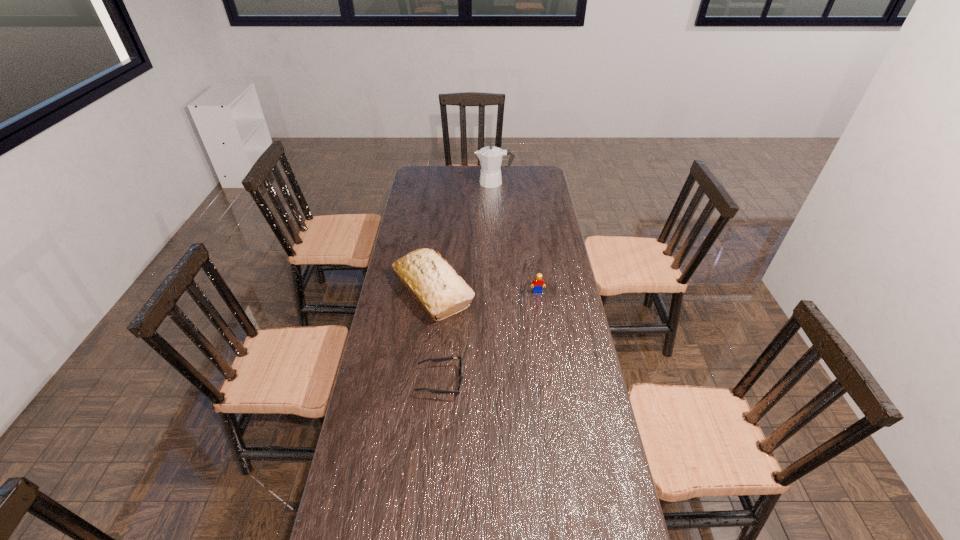
What are the coordinates of `the farthest object` in the screenshot? It's located at (490, 157).

This screenshot has width=960, height=540. Find the location of `coffeepot`. coffeepot is located at coordinates (490, 157).

Find the location of a particular element. the third shortest object is located at coordinates (433, 282).

Where is `Lego`? Image resolution: width=960 pixels, height=540 pixels. Lego is located at coordinates (538, 282).

This screenshot has width=960, height=540. Identify the location of the second shortest object. (538, 282).

Where is `the nearest object`? The height and width of the screenshot is (540, 960). the nearest object is located at coordinates (460, 369).

This screenshot has width=960, height=540. I want to click on the shortest object, so click(460, 369).

Find the location of a particular element. The height and width of the screenshot is (540, 960). blank space located at the spout of the tallest object is located at coordinates (456, 183).

At what (x,y) coordinates should I click in order to perform the action: click on vacant space located 0.050m at the spout of the tallest object. Please return your answer as a coordinate pair (x, y). The image size is (960, 540). Looking at the image, I should click on (466, 183).

Image resolution: width=960 pixels, height=540 pixels. What are the coordinates of `free space located 0.270m at the spout of the tallest object` in the screenshot? It's located at (424, 183).